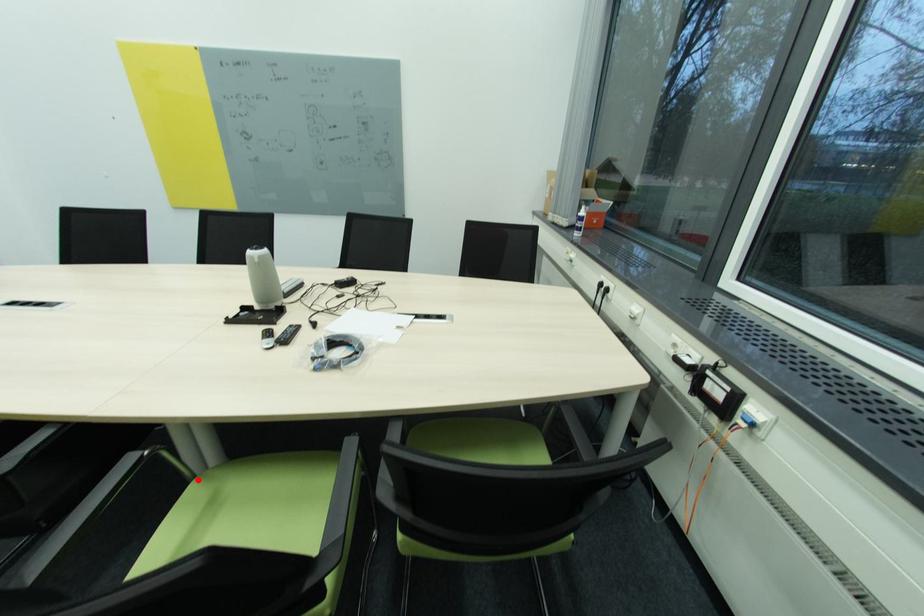
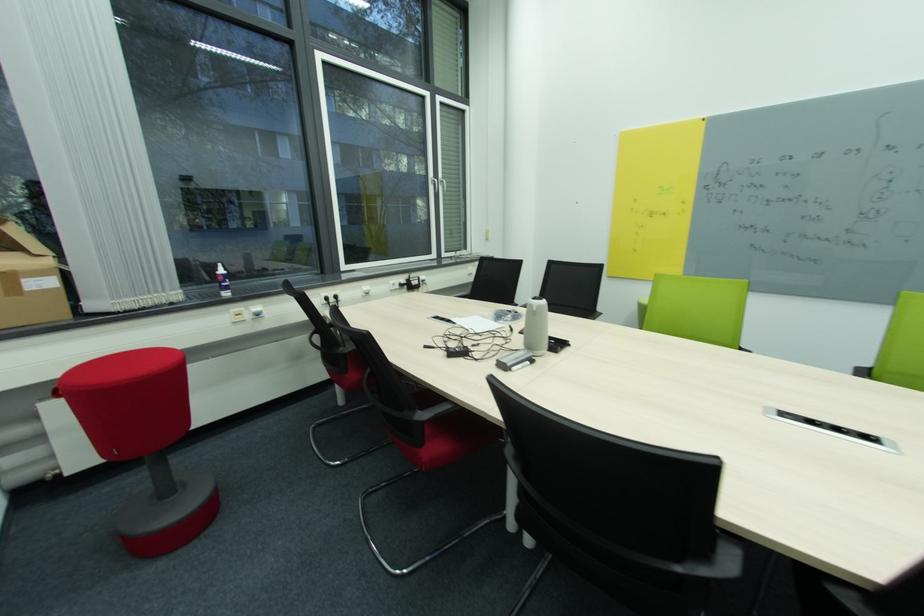
Question: I am providing you with two images of the same scene from different viewpoints. A red point is marked on the first image. Can you still see the location of the red point in image 2?

Choices:
 (A) Yes
 (B) No

Answer: (B)